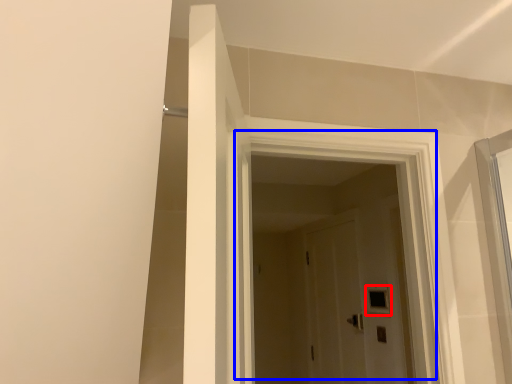
Question: Among these objects, which one is nearest to the camera, window (highlighted by a red box) or door (highlighted by a blue box)?

Choices:
 (A) window
 (B) door

Answer: (B)